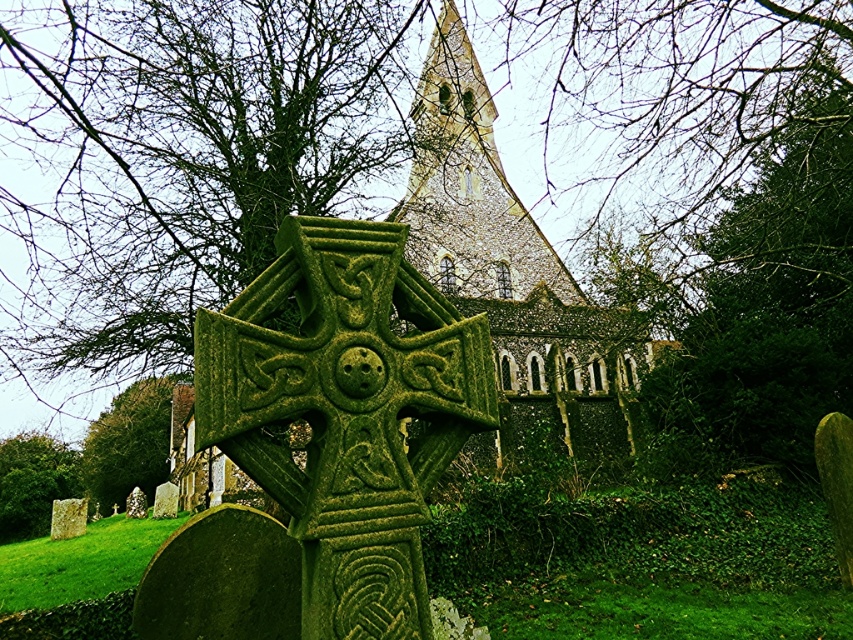
You are standing in the churchyard and see the Celtic cross monument in the foreground. There is a point marked at coordinates (129,444). Which object does this point belong to?

The point at (129,444) is on the green mossy tree at lower left.

You are standing in the churchyard and want to take a photo of the Celtic cross monument. To ensure the green mossy tree at lower left does not block the view, where should you position yourself relative to the tree?

You should position yourself to the right of the green mossy tree at lower left to avoid blocking the view of the Celtic cross monument.

You are a visitor standing in the churchyard looking at the green mossy stone cross at center and the green mossy stone at lower left. Which object is taller?

The green mossy stone at lower left is taller than the green mossy stone cross at center.